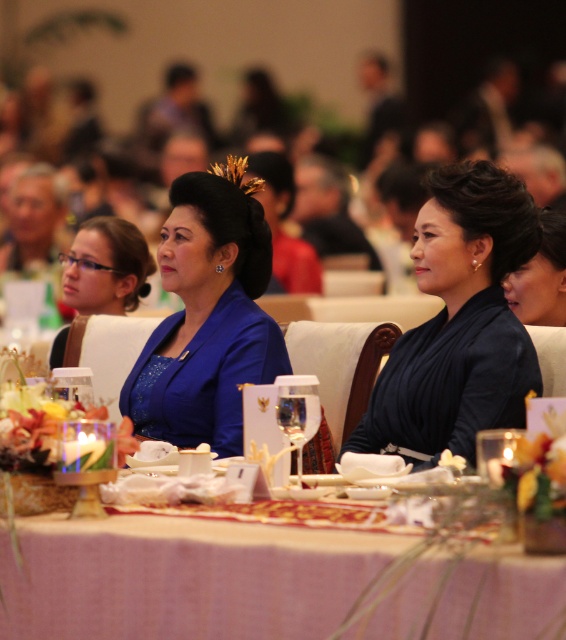
Which is more to the right, matte blue dress at center or clear glass wine glass at center?

clear glass wine glass at center is more to the right.

Who is higher up, matte blue dress at center or clear glass wine glass at center?

matte blue dress at center is above.

Identify the location of matte blue dress at center. Image resolution: width=566 pixels, height=640 pixels. (106, 266).

This screenshot has height=640, width=566. Identify the location of matte blue dress at center. (106, 266).

Can you confirm if black silk dress at center is thinner than blue satin dress at center?

In fact, black silk dress at center might be wider than blue satin dress at center.

Can you confirm if black silk dress at center is positioned to the left of blue satin dress at center?

Incorrect, black silk dress at center is not on the left side of blue satin dress at center.

You are a GUI agent. You are given a task and a screenshot of the screen. Output one action in this format:
    pyautogui.click(x=<x>, y=<y>)
    Task: Click on the black silk dress at center
    
    Given the screenshot: What is the action you would take?
    pyautogui.click(x=458, y=323)

Does black silk dress at center come in front of matte blue dress at center?

Yes, it is in front of matte blue dress at center.

Does black silk dress at center have a greater width compared to matte blue dress at center?

Indeed, black silk dress at center has a greater width compared to matte blue dress at center.

Find the location of a particular element. This screenshot has width=566, height=640. black silk dress at center is located at coordinates (458, 323).